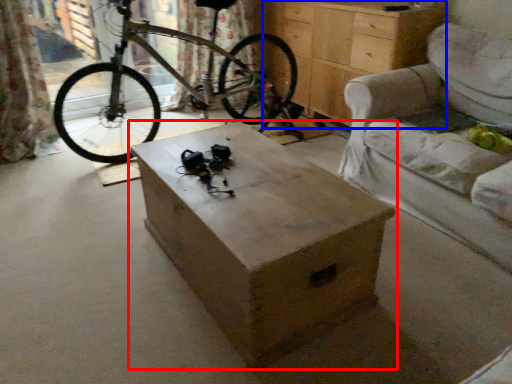
Question: Which object appears closest to the camera in this image, table (highlighted by a red box) or chest of drawers (highlighted by a blue box)?

Choices:
 (A) table
 (B) chest of drawers

Answer: (A)